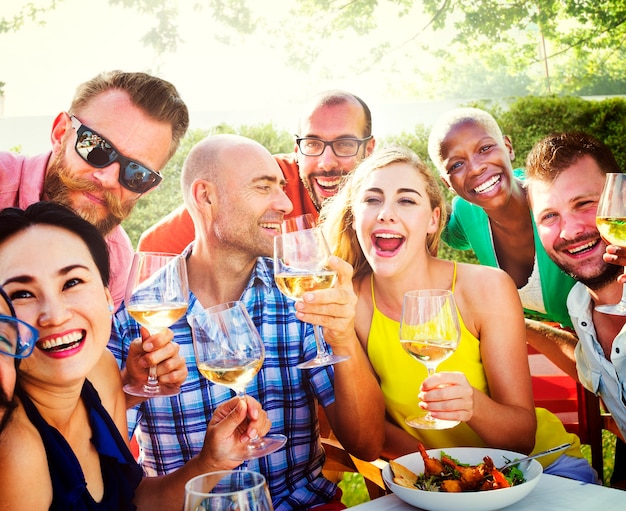
The height and width of the screenshot is (511, 626). Identify the location of wine glasses. (250, 499), (235, 367), (168, 293), (294, 257), (434, 327), (611, 214).